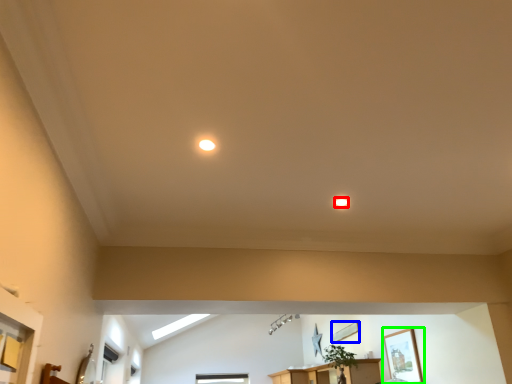
Question: Which is nearer to the lighting (highlighted by a red box)? picture frame (highlighted by a blue box) or picture frame (highlighted by a green box).

Choices:
 (A) picture frame
 (B) picture frame

Answer: (B)